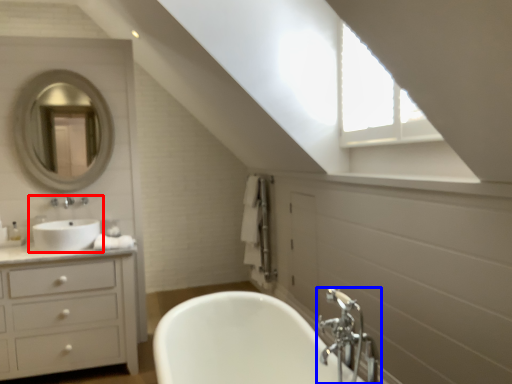
Question: Which of the following is the closest to the observer, sink (highlighted by a red box) or tap (highlighted by a blue box)?

Choices:
 (A) sink
 (B) tap

Answer: (B)